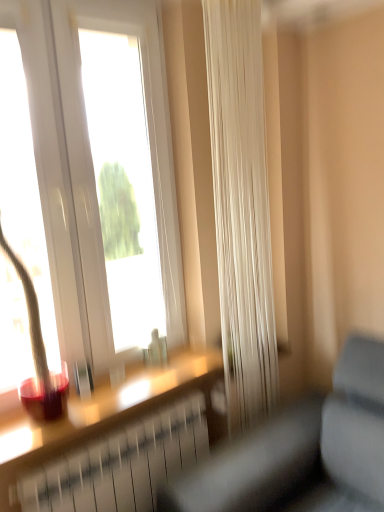
Question: In terms of height, does matte glass window sill at lower left look taller or shorter compared to gray fabric couch at lower right?

Choices:
 (A) tall
 (B) short

Answer: (B)

Question: Relative to gray fabric couch at lower right, is matte glass window sill at lower left in front or behind?

Choices:
 (A) front
 (B) behind

Answer: (B)

Question: Estimate the real-world distances between objects in this image. Which object is farther from the gray fabric couch at lower right?

Choices:
 (A) white sheer curtain at center
 (B) matte glass window sill at lower left

Answer: (A)

Question: Considering the real-world distances, which object is closest to the gray fabric couch at lower right?

Choices:
 (A) white sheer curtain at center
 (B) matte glass window sill at lower left

Answer: (B)